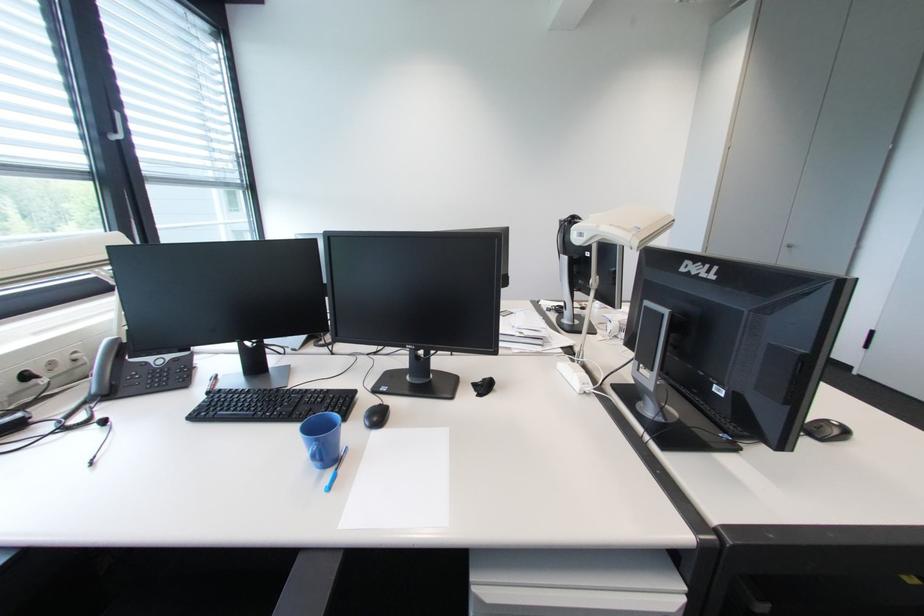
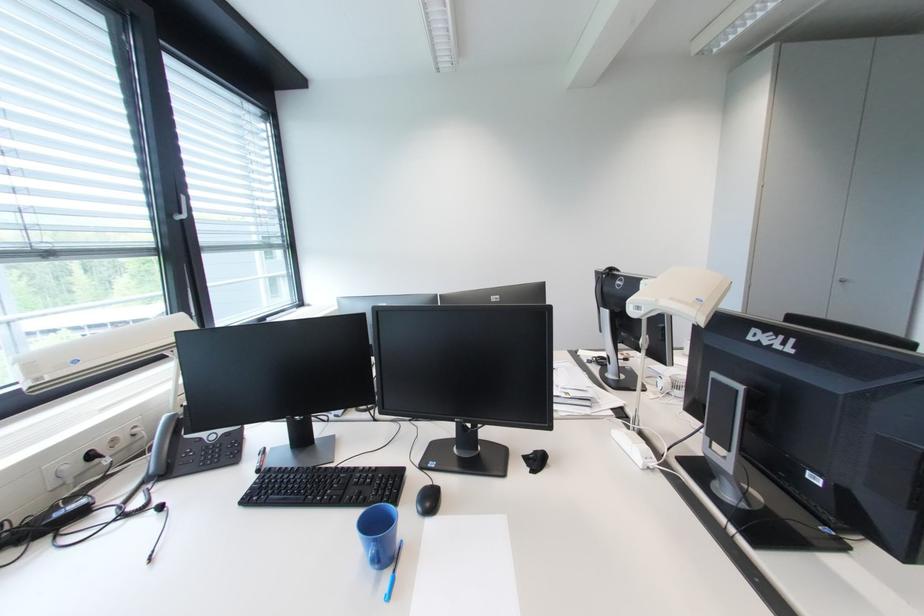
The point at (123, 134) is marked in the first image. Where is the corresponding point in the second image?

(188, 215)